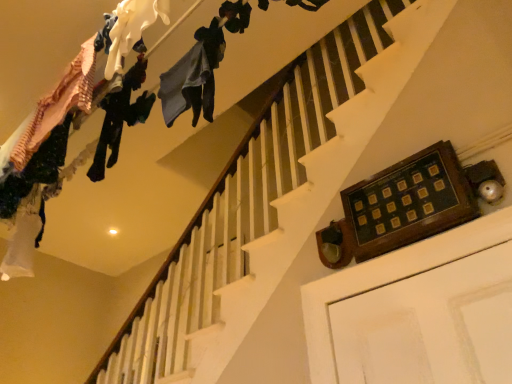
Question: From the image's perspective, is dark blue fabric at upper center, the 3th clothing viewed from the left, over matte white fabric at upper left, positioned as the 2th clothing in right-to-left order?

Choices:
 (A) yes
 (B) no

Answer: (B)

Question: From the image's perspective, is dark blue fabric at upper center, the first clothing when ordered from right to left, under matte white fabric at upper left, arranged as the second clothing when viewed from the left?

Choices:
 (A) yes
 (B) no

Answer: (A)

Question: Is dark blue fabric at upper center, the first clothing when ordered from right to left, at the left side of matte white fabric at upper left, positioned as the 2th clothing in right-to-left order?

Choices:
 (A) yes
 (B) no

Answer: (B)

Question: From a real-world perspective, does dark blue fabric at upper center, the 3th clothing viewed from the left, stand above matte white fabric at upper left, arranged as the second clothing when viewed from the left?

Choices:
 (A) yes
 (B) no

Answer: (B)

Question: Can you confirm if dark blue fabric at upper center, the 3th clothing viewed from the left, is thinner than matte white fabric at upper left, positioned as the 2th clothing in right-to-left order?

Choices:
 (A) no
 (B) yes

Answer: (A)

Question: Does dark blue fabric at upper center, the 3th clothing viewed from the left, come behind matte white fabric at upper left, arranged as the second clothing when viewed from the left?

Choices:
 (A) no
 (B) yes

Answer: (B)

Question: Is matte white fabric at upper left, arranged as the second clothing when viewed from the left, facing away from dark green fabric pants at upper left, which is the first clothing in left-to-right order?

Choices:
 (A) yes
 (B) no

Answer: (B)

Question: Is matte white fabric at upper left, arranged as the second clothing when viewed from the left, wider than dark green fabric pants at upper left, which is counted as the third clothing, starting from the right?

Choices:
 (A) no
 (B) yes

Answer: (A)

Question: Is matte white fabric at upper left, arranged as the second clothing when viewed from the left, directly adjacent to dark green fabric pants at upper left, which is the first clothing in left-to-right order?

Choices:
 (A) no
 (B) yes

Answer: (A)

Question: Can we say matte white fabric at upper left, arranged as the second clothing when viewed from the left, lies outside dark green fabric pants at upper left, which is the first clothing in left-to-right order?

Choices:
 (A) no
 (B) yes

Answer: (B)

Question: Considering the relative positions of matte white fabric at upper left, positioned as the 2th clothing in right-to-left order, and dark green fabric pants at upper left, which is counted as the third clothing, starting from the right, in the image provided, is matte white fabric at upper left, positioned as the 2th clothing in right-to-left order, to the left of dark green fabric pants at upper left, which is counted as the third clothing, starting from the right, from the viewer's perspective?

Choices:
 (A) yes
 (B) no

Answer: (B)

Question: Is matte white fabric at upper left, positioned as the 2th clothing in right-to-left order, bigger than dark green fabric pants at upper left, which is counted as the third clothing, starting from the right?

Choices:
 (A) no
 (B) yes

Answer: (A)

Question: Does matte white fabric at upper left, positioned as the 2th clothing in right-to-left order, appear on the left side of dark blue fabric at upper center, the first clothing when ordered from right to left?

Choices:
 (A) no
 (B) yes

Answer: (B)